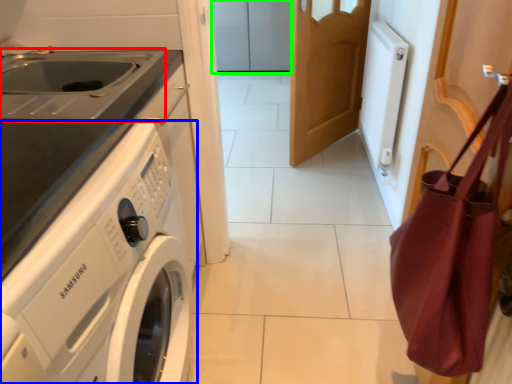
Question: Which object is positioned farthest from sink (highlighted by a red box)? Select from washing machine (highlighted by a blue box) and cabinetry (highlighted by a green box).

Choices:
 (A) washing machine
 (B) cabinetry

Answer: (B)